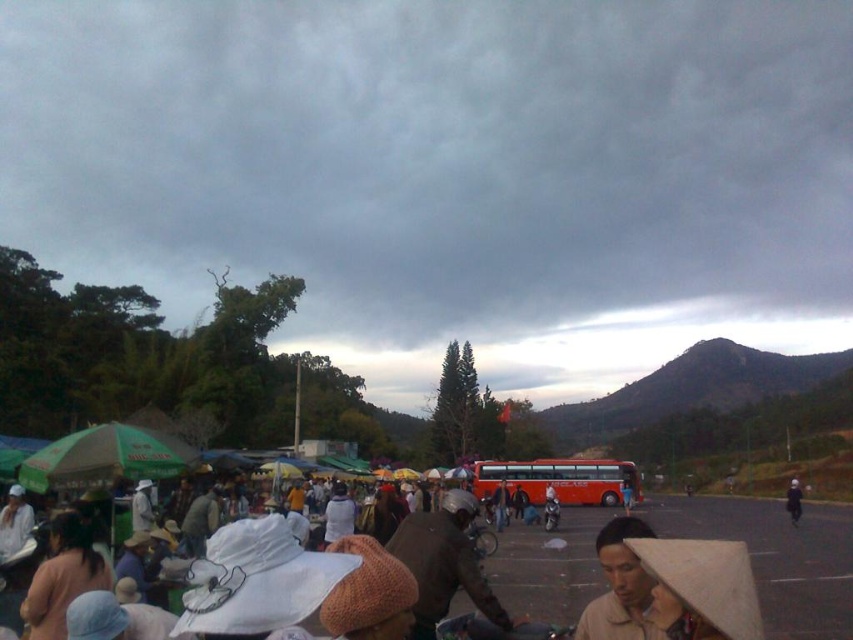
Question: Is white fabric hat at center behind metallic silver motorcycle at center?

Choices:
 (A) no
 (B) yes

Answer: (A)

Question: Can you confirm if orange matte bus at center is bigger than brown leather jacket at center?

Choices:
 (A) yes
 (B) no

Answer: (A)

Question: Considering the real-world distances, which object is farthest from the brown leather jacket at center?

Choices:
 (A) brown fabric hat at center
 (B) orange matte bus at center

Answer: (A)

Question: Which point is farther from the camera taking this photo?

Choices:
 (A) (640, 628)
 (B) (798, 497)

Answer: (B)

Question: Among these points, which one is nearest to the camera?

Choices:
 (A) (434, 552)
 (B) (543, 518)
 (C) (564, 492)
 (D) (637, 563)

Answer: (D)

Question: Does brown woven hat at lower right appear over orange matte bus at center?

Choices:
 (A) yes
 (B) no

Answer: (A)